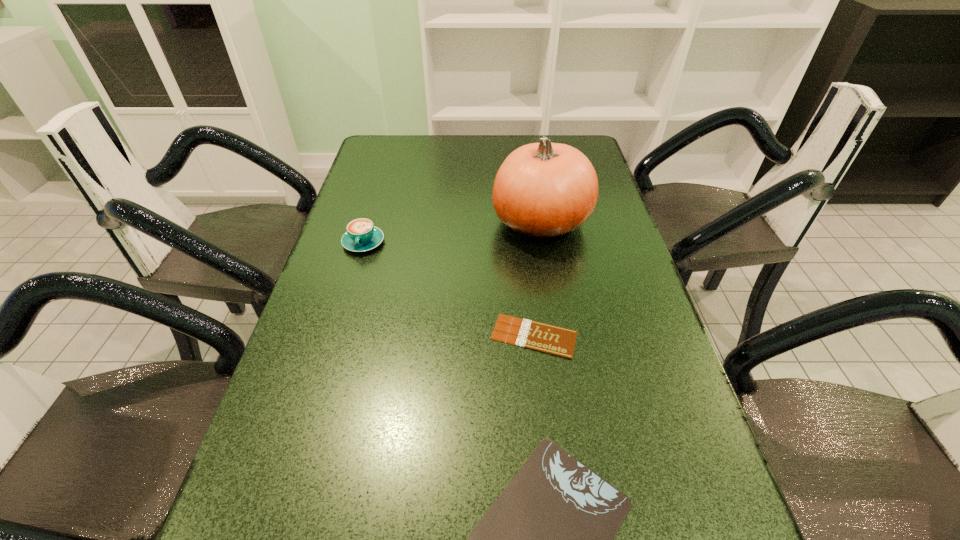
Locate an element on the screen. The image size is (960, 540). blank space at the far edge of the desktop is located at coordinates (498, 147).

Where is `blank area at the left edge`? The image size is (960, 540). blank area at the left edge is located at coordinates (334, 401).

Where is `free spot at the right edge of the desktop`? free spot at the right edge of the desktop is located at coordinates (640, 515).

Locate an element on the screen. This screenshot has height=540, width=960. vacant space at the far left corner is located at coordinates (396, 143).

Image resolution: width=960 pixels, height=540 pixels. In order to click on vacant space at the far right corner of the desktop in this screenshot , I will do pos(579,140).

Where is `vacant area that lies between the chocolate bar and the tallest object`? vacant area that lies between the chocolate bar and the tallest object is located at coordinates (538, 279).

Where is `vacant space that's between the tallest object and the chocolate bar`? The image size is (960, 540). vacant space that's between the tallest object and the chocolate bar is located at coordinates (538, 279).

You are a GUI agent. You are given a task and a screenshot of the screen. Output one action in this format:
    pyautogui.click(x=<x>, y=<y>)
    Task: Click on the empty space that is in between the pumpkin and the cappuccino
    This screenshot has width=960, height=540.
    Given the screenshot: What is the action you would take?
    pyautogui.click(x=452, y=232)

Find the location of a particular element. empty space between the pumpkin and the second shortest object is located at coordinates (538, 279).

Image resolution: width=960 pixels, height=540 pixels. What are the coordinates of `free space between the chocolate bar and the cappuccino` in the screenshot? It's located at (449, 289).